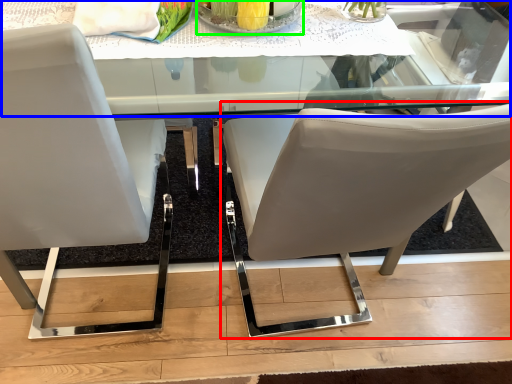
Question: Which object is positioned farthest from chair (highlighted by a red box)? Select from round table (highlighted by a blue box) and glass plate (highlighted by a green box).

Choices:
 (A) round table
 (B) glass plate

Answer: (B)